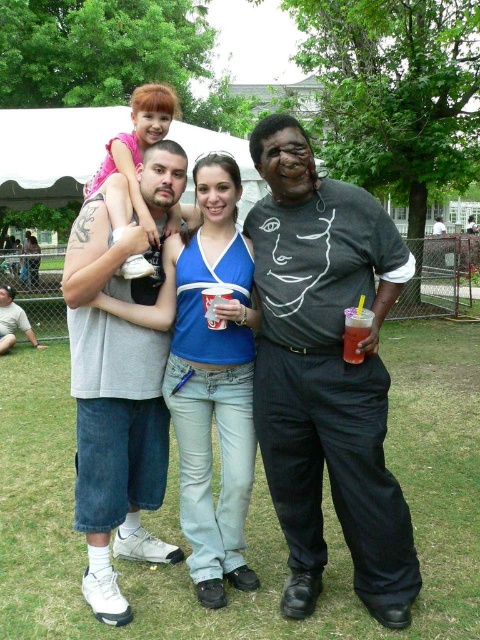
Based on the coordinates provided, which object is located at point (115, 408) in the image?

The gray cotton t shirt at center is located at point (115, 408).

You are a photographer trying to capture a photo of the blue denim jeans at center and the brushed metal water at bottle left. Which object should you focus on first if you want to ensure both are in focus without adjusting the camera settings?

The blue denim jeans at center is taller than the brushed metal water at bottle left, so focusing on the blue denim jeans at center first would help ensure both are in focus since it is the larger object.

You are standing at the point labeled as point (81, 225) and want to walk to the point labeled as point (231, 573). Which direction should you walk to reach your destination?

You should walk backward because point (81, 225) is in front of point (231, 573), so moving away from the direction you are facing would lead you towards the destination.